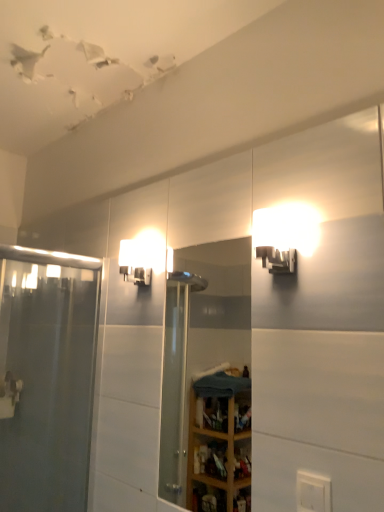
Question: Which direction should I rotate to face matte white sconce at upper center, which is the 2th light fixture in right-to-left order, — up or down?

Choices:
 (A) down
 (B) up

Answer: (A)

Question: Is matte white sconce at upper center, acting as the second light fixture starting from the front, shorter than matte white sconce at upper right, the first light fixture in the right-to-left sequence?

Choices:
 (A) yes
 (B) no

Answer: (A)

Question: From the image's perspective, is matte white sconce at upper center, which is the 1th light fixture from back to front, on matte white sconce at upper right, placed as the 2th light fixture when sorted from left to right?

Choices:
 (A) no
 (B) yes

Answer: (A)

Question: Does matte white sconce at upper center, which ranks as the first light fixture in left-to-right order, appear on the left side of matte white sconce at upper right, the 1th light fixture from the front?

Choices:
 (A) no
 (B) yes

Answer: (B)

Question: Could you tell me if matte white sconce at upper center, which is the 1th light fixture from back to front, is turned towards matte white sconce at upper right, marked as the 2th light fixture in a back-to-front arrangement?

Choices:
 (A) no
 (B) yes

Answer: (A)

Question: Is matte white sconce at upper center, which is the 1th light fixture from back to front, positioned behind matte white sconce at upper right, the 1th light fixture from the front?

Choices:
 (A) no
 (B) yes

Answer: (B)

Question: Is matte white sconce at upper center, which ranks as the first light fixture in left-to-right order, bigger than matte white sconce at upper right, the first light fixture in the right-to-left sequence?

Choices:
 (A) no
 (B) yes

Answer: (A)

Question: Is white plastic electric outlet at lower right positioned far away from matte white sconce at upper right, placed as the 2th light fixture when sorted from left to right?

Choices:
 (A) yes
 (B) no

Answer: (B)

Question: Is white plastic electric outlet at lower right further to the viewer compared to matte white sconce at upper right, the first light fixture in the right-to-left sequence?

Choices:
 (A) no
 (B) yes

Answer: (A)

Question: Is white plastic electric outlet at lower right smaller than matte white sconce at upper right, the 1th light fixture from the front?

Choices:
 (A) no
 (B) yes

Answer: (B)

Question: Does white plastic electric outlet at lower right have a lesser height compared to matte white sconce at upper right, marked as the 2th light fixture in a back-to-front arrangement?

Choices:
 (A) yes
 (B) no

Answer: (B)

Question: From a real-world perspective, is white plastic electric outlet at lower right positioned under matte white sconce at upper right, placed as the 2th light fixture when sorted from left to right, based on gravity?

Choices:
 (A) no
 (B) yes

Answer: (B)

Question: Is white plastic electric outlet at lower right completely or partially outside of matte white sconce at upper right, the first light fixture in the right-to-left sequence?

Choices:
 (A) no
 (B) yes

Answer: (B)

Question: From the image's perspective, is matte white sconce at upper center, acting as the second light fixture starting from the front, on top of clear glass shower door at left?

Choices:
 (A) yes
 (B) no

Answer: (A)